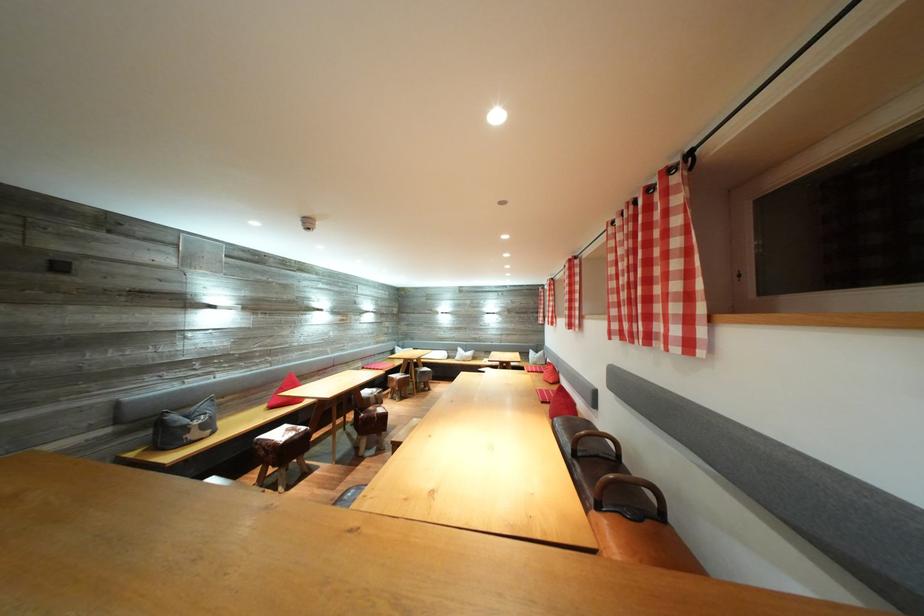
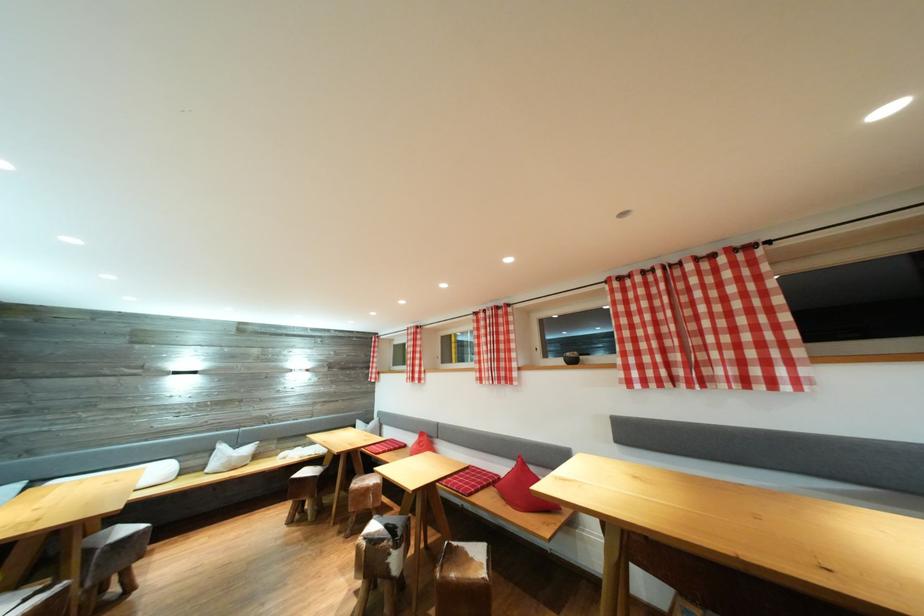
Locate, in the second image, the point that corresponds to [467,355] in the first image.

(228, 453)